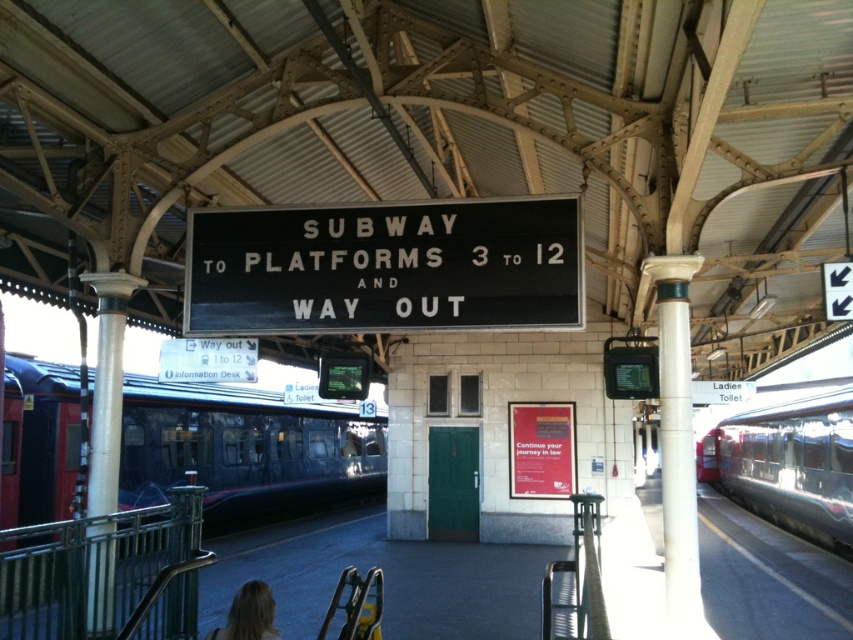
Question: Is black matte sign at center in front of blonde hair at lower left?

Choices:
 (A) yes
 (B) no

Answer: (B)

Question: Does dark blue metallic train at left come in front of blonde hair at lower left?

Choices:
 (A) no
 (B) yes

Answer: (A)

Question: Which object is positioned farthest from the blonde hair at lower left?

Choices:
 (A) dark blue metallic train at left
 (B) black matte sign at center

Answer: (A)

Question: Which point is closer to the camera?

Choices:
 (A) black matte sign at center
 (B) polished stainless steel train at right
 (C) blonde hair at lower left
 (D) dark blue metallic train at left

Answer: (C)

Question: Which of the following is the farthest from the observer?

Choices:
 (A) (228, 632)
 (B) (747, 428)

Answer: (B)

Question: Is polished stainless steel train at right positioned behind blonde hair at lower left?

Choices:
 (A) no
 (B) yes

Answer: (B)